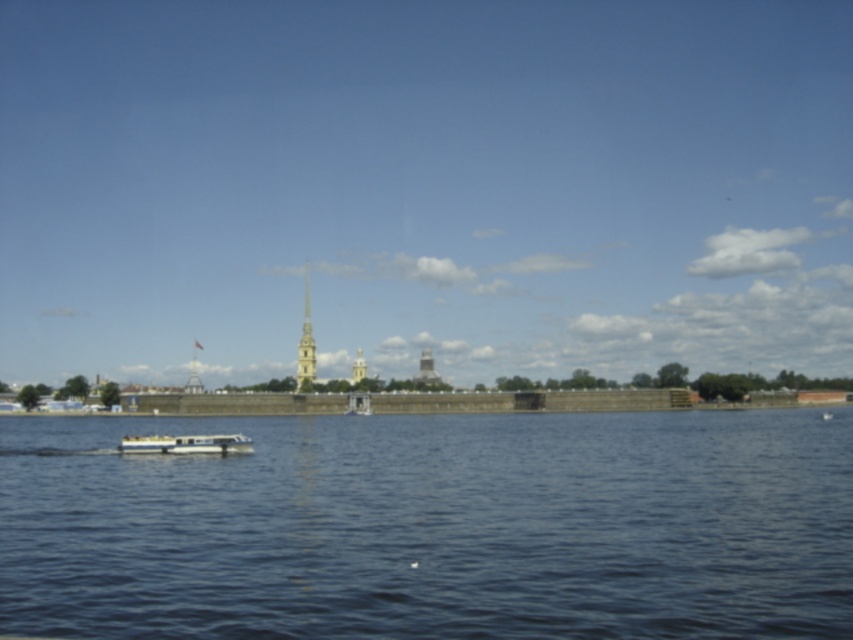
Can you confirm if blue water at center is positioned to the right of white glossy boat at lower left?

Correct, you'll find blue water at center to the right of white glossy boat at lower left.

Is blue water at center wider than white glossy boat at lower left?

Indeed, blue water at center has a greater width compared to white glossy boat at lower left.

Does point (753, 547) lie in front of point (184, 445)?

Yes, point (753, 547) is in front of point (184, 445).

At what (x,y) coordinates should I click in order to perform the action: click on blue water at center. Please return your answer as a coordinate pair (x, y). Looking at the image, I should click on (432, 525).

Where is `blue water at center`? Image resolution: width=853 pixels, height=640 pixels. blue water at center is located at coordinates (432, 525).

Who is shorter, blue water at center or smooth gold spire at center?

blue water at center is shorter.

Between point (135, 627) and point (303, 348), which one is positioned in front?

Positioned in front is point (135, 627).

The width and height of the screenshot is (853, 640). In order to click on blue water at center in this screenshot , I will do `click(432, 525)`.

The width and height of the screenshot is (853, 640). What do you see at coordinates (187, 444) in the screenshot? I see `white glossy boat at lower left` at bounding box center [187, 444].

Does white glossy boat at lower left appear on the right side of smooth gold spire at center?

Indeed, white glossy boat at lower left is positioned on the right side of smooth gold spire at center.

The width and height of the screenshot is (853, 640). Find the location of `white glossy boat at lower left`. white glossy boat at lower left is located at coordinates (187, 444).

This screenshot has height=640, width=853. What are the coordinates of `white glossy boat at lower left` in the screenshot? It's located at (187, 444).